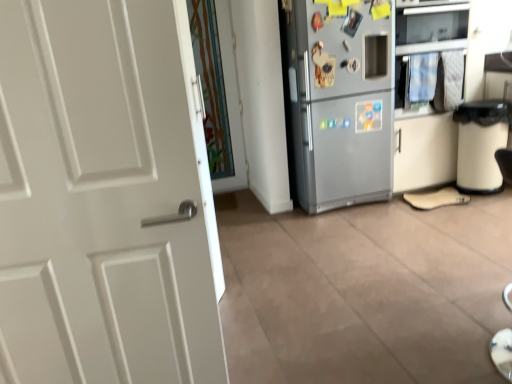
Question: From the image's perspective, is satin silver oven at upper right over beige suede shoe at lower right?

Choices:
 (A) yes
 (B) no

Answer: (A)

Question: Is satin silver oven at upper right completely or partially outside of beige suede shoe at lower right?

Choices:
 (A) no
 (B) yes

Answer: (B)

Question: Can you confirm if satin silver oven at upper right is thinner than beige suede shoe at lower right?

Choices:
 (A) yes
 (B) no

Answer: (B)

Question: Considering the relative positions of satin silver oven at upper right and beige suede shoe at lower right in the image provided, is satin silver oven at upper right in front of beige suede shoe at lower right?

Choices:
 (A) yes
 (B) no

Answer: (A)

Question: Is beige suede shoe at lower right surrounded by satin silver oven at upper right?

Choices:
 (A) yes
 (B) no

Answer: (B)

Question: From a real-world perspective, is satin silver oven at upper right positioned over beige suede shoe at lower right based on gravity?

Choices:
 (A) no
 (B) yes

Answer: (B)

Question: Is white plastic trash bin at right not near beige suede shoe at lower right?

Choices:
 (A) yes
 (B) no

Answer: (B)

Question: Considering the relative sizes of white plastic trash bin at right and beige suede shoe at lower right in the image provided, is white plastic trash bin at right bigger than beige suede shoe at lower right?

Choices:
 (A) no
 (B) yes

Answer: (B)

Question: Does white plastic trash bin at right turn towards beige suede shoe at lower right?

Choices:
 (A) no
 (B) yes

Answer: (A)

Question: Considering the relative positions of white plastic trash bin at right and beige suede shoe at lower right in the image provided, is white plastic trash bin at right to the right of beige suede shoe at lower right from the viewer's perspective?

Choices:
 (A) yes
 (B) no

Answer: (A)

Question: Does white plastic trash bin at right have a greater width compared to beige suede shoe at lower right?

Choices:
 (A) no
 (B) yes

Answer: (B)

Question: From the image's perspective, is white plastic trash bin at right located beneath beige suede shoe at lower right?

Choices:
 (A) no
 (B) yes

Answer: (A)

Question: From a real-world perspective, is transparent glass door at center positioned under satin silver oven at upper right based on gravity?

Choices:
 (A) yes
 (B) no

Answer: (A)